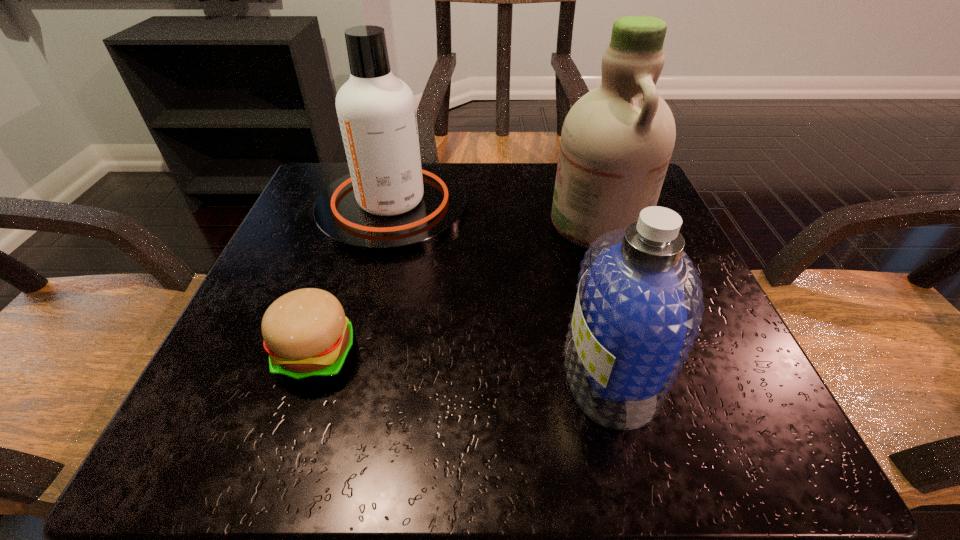
Select which object appears as the closest to the second shortest object. Please provide its 2D coordinates. Your answer should be formatted as a tuple, i.e. [(x, y)], where the tuple contains the x and y coordinates of a point satisfying the conditions above.

[(616, 142)]

Find the location of `object that is the second closest one to the shortest object`. object that is the second closest one to the shortest object is located at coordinates tap(638, 308).

Identify the location of the second closest cleansing agent to the shortest object. This screenshot has width=960, height=540. (638, 308).

Select which cleansing agent is the second closest to the third tallest object. Please provide its 2D coordinates. Your answer should be formatted as a tuple, i.e. [(x, y)], where the tuple contains the x and y coordinates of a point satisfying the conditions above.

[(389, 204)]

This screenshot has width=960, height=540. In order to click on free space that satisfies the following two spatial constraints: 1. on the back side of the hamburger; 2. on the right side of the leftmost cleansing agent in this screenshot , I will do `click(366, 209)`.

Locate an element on the screen. free space that satisfies the following two spatial constraints: 1. on the front side of the hamburger; 2. on the left side of the third tallest object is located at coordinates (310, 374).